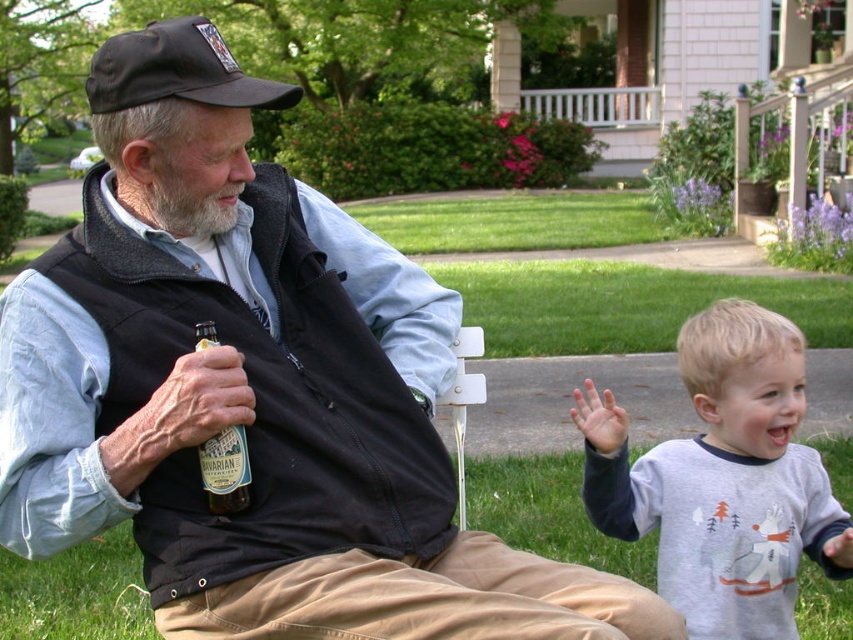
You are a photographer trying to capture a closeup of the gray cotton shirt at lower right and the green grass at lower center. Which object should you zoom in on first to ensure it fits entirely within your camera frame?

The gray cotton shirt at lower right is bigger than the green grass at lower center, so you should zoom in on the gray cotton shirt at lower right first to ensure it fits entirely within your camera frame.

You are a photographer trying to capture a group photo of the gray cotton shirt at lower right and the graywoollybeard at left. If you want to ensure both subjects are fully visible in the frame, which subject should you position closer to the camera to avoid cropping?

Since the gray cotton shirt at lower right is wider than the graywoollybeard at left, you should position the gray cotton shirt at lower right closer to the camera to ensure its full width fits within the frame without cropping.

You are a photographer standing at the center of the scene. You want to take a photo of the black fabric baseball cap at upper left and the young child with short blonde hair. How far apart should you position the two subjects in your photo?

The black fabric baseball cap at upper left and the young child with short blonde hair are 7.20 feet apart, so you should position them 7.20 feet apart in your photo to accurately capture their actual distance.